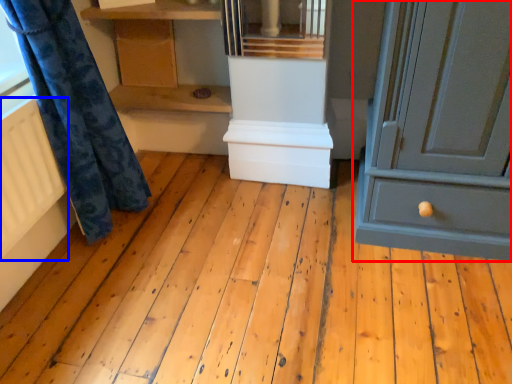
Question: Which object appears closest to the camera in this image, chest of drawers (highlighted by a red box) or radiator (highlighted by a blue box)?

Choices:
 (A) chest of drawers
 (B) radiator

Answer: (A)